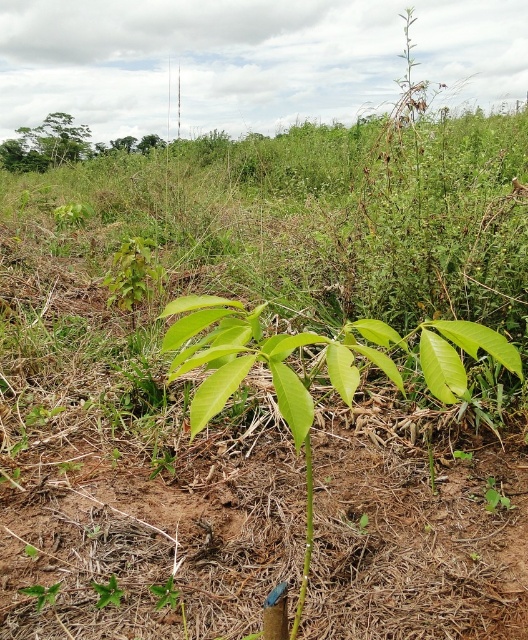
From the picture: Between green glossy leaf at center and green leafy tree at upper left, which one appears on the right side from the viewer's perspective?

From the viewer's perspective, green glossy leaf at center appears more on the right side.

Which is behind, point (312, 544) or point (72, 129)?

The point (72, 129) is behind.

Between point (356, 337) and point (18, 134), which one is positioned in front?

Point (356, 337)

Locate an element on the screen. green glossy leaf at center is located at coordinates (314, 369).